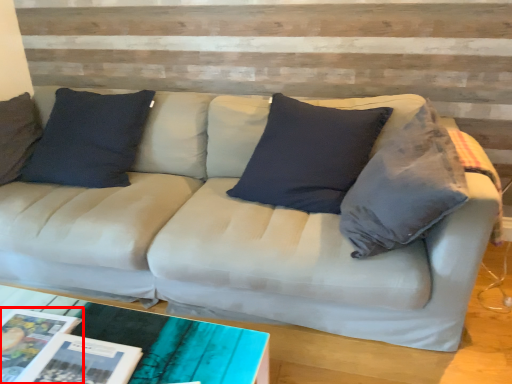
Question: In this image, where is magazine (annotated by the red box) located relative to magazine?

Choices:
 (A) left
 (B) right

Answer: (A)